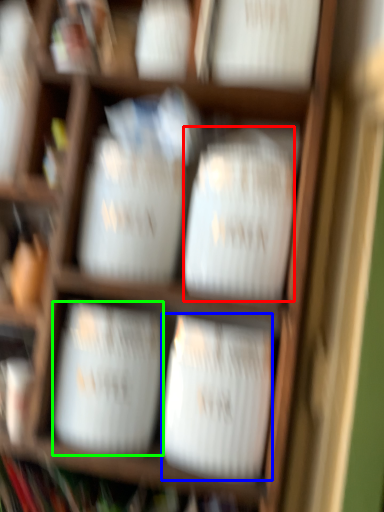
Question: Estimate the real-world distances between objects in this image. Which object is closer to wide (highlighted by a red box), wide (highlighted by a blue box) or wide (highlighted by a green box)?

Choices:
 (A) wide
 (B) wide

Answer: (A)